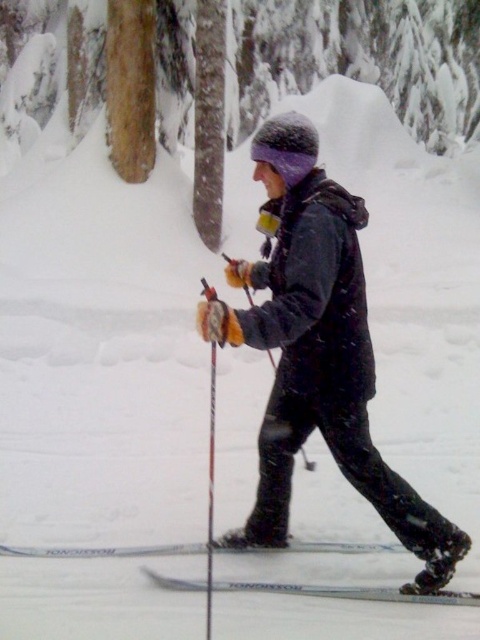
Question: Is silver metallic ski at lower center wider than white glossy ski at lower center?

Choices:
 (A) no
 (B) yes

Answer: (B)

Question: Which object is farther from the camera taking this photo?

Choices:
 (A) matte black ski pole at center
 (B) white glossy ski at lower center

Answer: (B)

Question: Which of the following is the closest to the observer?

Choices:
 (A) matte black ski pole at center
 (B) silver metallic ski at lower center

Answer: (A)

Question: Does brown wood tree at center appear under white glossy ski at lower center?

Choices:
 (A) yes
 (B) no

Answer: (B)

Question: Can you confirm if matte black ski pole at center is thinner than silver metallic ski at lower center?

Choices:
 (A) yes
 (B) no

Answer: (A)

Question: Which point appears farthest from the camera in this image?

Choices:
 (A) (232, 314)
 (B) (84, 552)
 (C) (10, 554)
 (D) (320, 589)

Answer: (C)